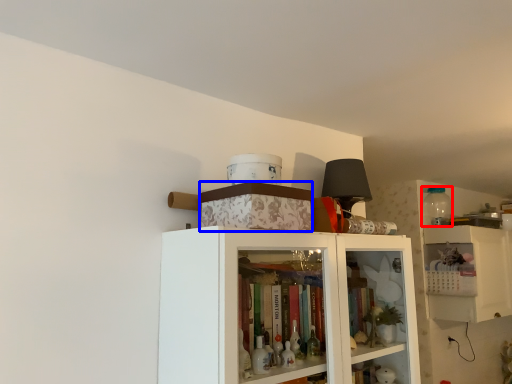
Question: Which object is further to the camera taking this photo, bottle (highlighted by a red box) or box (highlighted by a blue box)?

Choices:
 (A) bottle
 (B) box

Answer: (A)